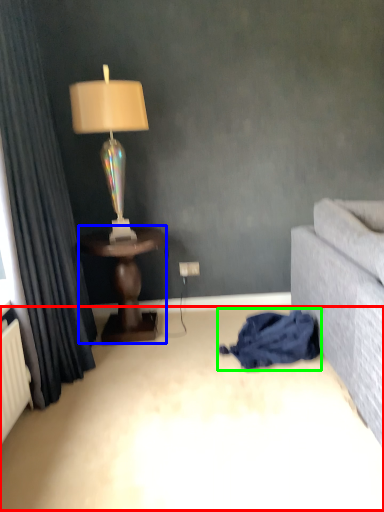
Question: Based on their relative distances, which object is farther from plain (highlighted by a red box)? Choose from table (highlighted by a blue box) and blanket (highlighted by a green box).

Choices:
 (A) table
 (B) blanket

Answer: (A)